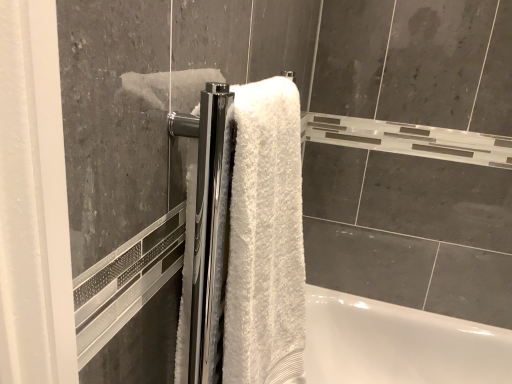
Describe the element at coordinates (397, 344) in the screenshot. The height and width of the screenshot is (384, 512). I see `white glossy bathtub at lower right` at that location.

At what (x,y) coordinates should I click in order to perform the action: click on white glossy bathtub at lower right. Please return your answer as a coordinate pair (x, y). Looking at the image, I should click on (397, 344).

The image size is (512, 384). What are the coordinates of `white glossy bathtub at lower right` in the screenshot? It's located at (397, 344).